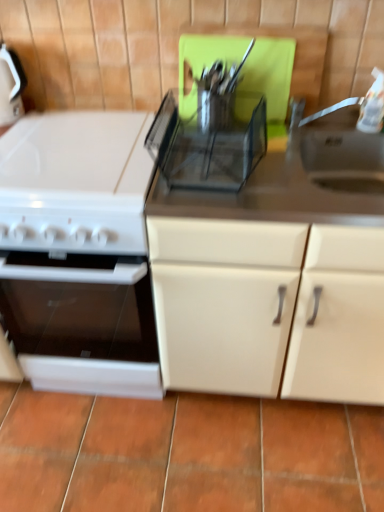
Question: From a real-world perspective, is terracotta tile at lower center located beneath matte white cabinet at center?

Choices:
 (A) no
 (B) yes

Answer: (B)

Question: From the image's perspective, does terracotta tile at lower center appear higher than matte white cabinet at center?

Choices:
 (A) no
 (B) yes

Answer: (A)

Question: Is terracotta tile at lower center not inside matte white cabinet at center?

Choices:
 (A) yes
 (B) no

Answer: (A)

Question: Does terracotta tile at lower center have a lesser height compared to matte white cabinet at center?

Choices:
 (A) yes
 (B) no

Answer: (A)

Question: From the image's perspective, would you say terracotta tile at lower center is shown under matte white cabinet at center?

Choices:
 (A) no
 (B) yes

Answer: (B)

Question: Looking at their shapes, would you say matte white cabinet at center is wider or thinner than terracotta tile at lower center?

Choices:
 (A) wide
 (B) thin

Answer: (B)

Question: Based on their sizes in the image, would you say matte white cabinet at center is bigger or smaller than terracotta tile at lower center?

Choices:
 (A) small
 (B) big

Answer: (B)

Question: Relative to terracotta tile at lower center, is matte white cabinet at center in front or behind?

Choices:
 (A) front
 (B) behind

Answer: (A)

Question: Is matte white cabinet at center taller or shorter than terracotta tile at lower center?

Choices:
 (A) short
 (B) tall

Answer: (B)

Question: Based on their sizes in the image, would you say transparent plastic utensil rack at center is bigger or smaller than matte white cabinet at center?

Choices:
 (A) small
 (B) big

Answer: (A)

Question: From the image's perspective, is transparent plastic utensil rack at center located above or below matte white cabinet at center?

Choices:
 (A) above
 (B) below

Answer: (A)

Question: Considering the positions of point (205, 158) and point (273, 390), is point (205, 158) closer or farther from the camera than point (273, 390)?

Choices:
 (A) closer
 (B) farther

Answer: (A)

Question: Considering their positions, is transparent plastic utensil rack at center located in front of or behind matte white cabinet at center?

Choices:
 (A) behind
 (B) front

Answer: (A)

Question: Considering the relative positions of white glossy oven at left and transparent plastic utensil rack at center in the image provided, is white glossy oven at left to the left or to the right of transparent plastic utensil rack at center?

Choices:
 (A) left
 (B) right

Answer: (A)

Question: From the image's perspective, is white glossy oven at left above or below transparent plastic utensil rack at center?

Choices:
 (A) below
 (B) above

Answer: (A)